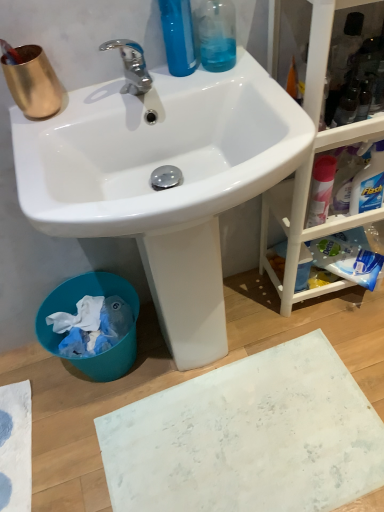
The height and width of the screenshot is (512, 384). I want to click on free space between gold metallic cup at upper left and chrome metallic faucet at upper center, so click(x=87, y=104).